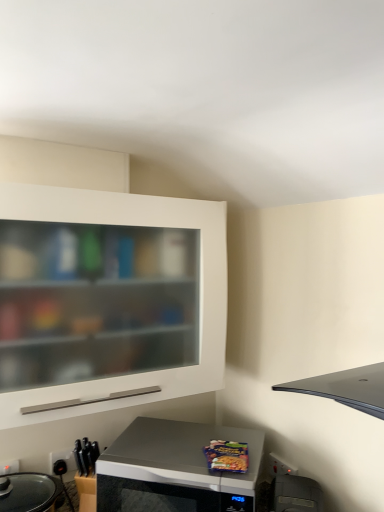
The image size is (384, 512). Find the location of `free space above silver metallic microwave at lower center (from a real-world perspective)`. free space above silver metallic microwave at lower center (from a real-world perspective) is located at coordinates (177, 440).